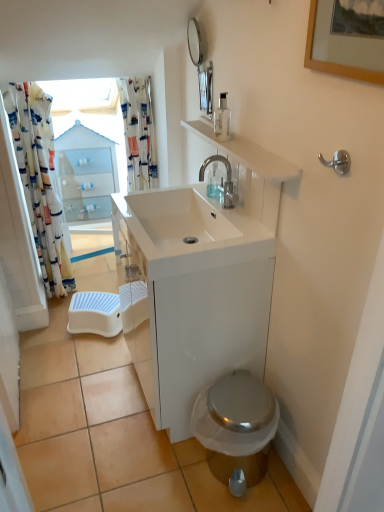
I want to click on free location in front of white glossy cabinet at center, so click(x=158, y=470).